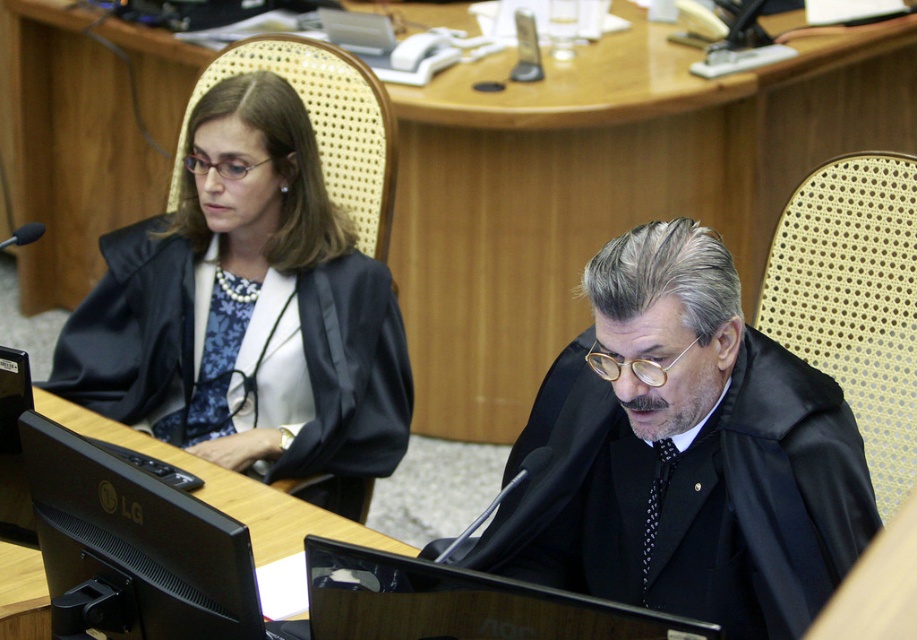
Question: Which of the following is the closest to the observer?

Choices:
 (A) (182, 396)
 (B) (724, 493)

Answer: (B)

Question: Is satin black robe at left positioned in front of black matte robe at center?

Choices:
 (A) yes
 (B) no

Answer: (B)

Question: Is satin black robe at left positioned behind black matte robe at center?

Choices:
 (A) yes
 (B) no

Answer: (A)

Question: Can you confirm if satin black robe at left is positioned to the left of black matte robe at center?

Choices:
 (A) yes
 (B) no

Answer: (A)